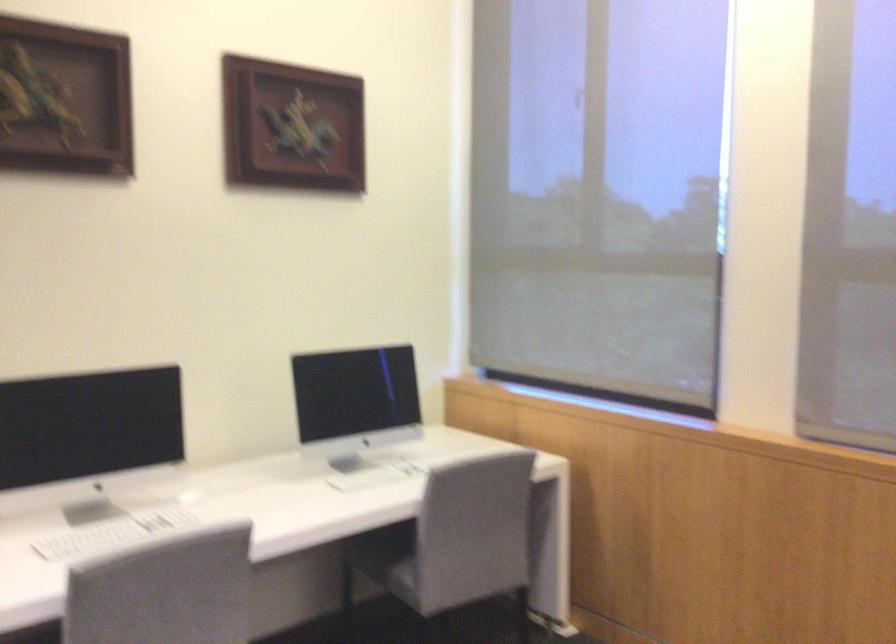
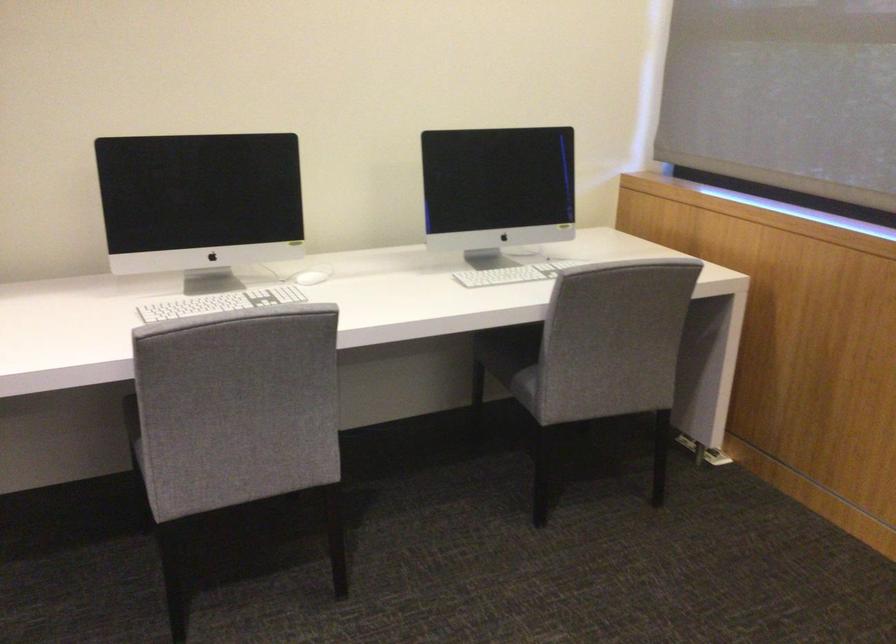
Locate, in the second image, the point that corresponds to (x=388, y=474) in the first image.

(519, 270)